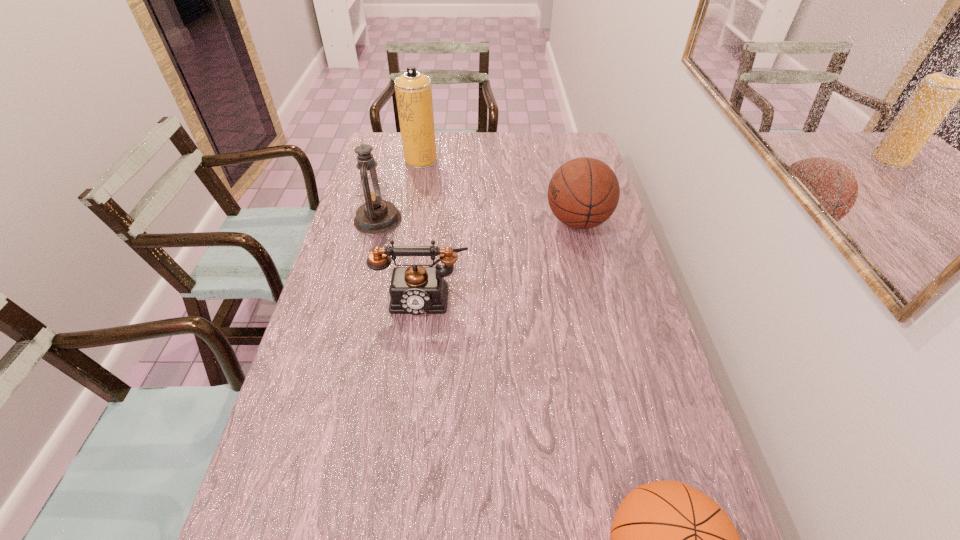
You are a GUI agent. You are given a task and a screenshot of the screen. Output one action in this format:
    pyautogui.click(x=<x>, y=<y>)
    Task: Click on the vacant space that's between the farther basketball and the fourth farthest object
    
    Given the screenshot: What is the action you would take?
    pyautogui.click(x=500, y=258)

Where is `free space between the fourth shortest object and the farther basketball`? Image resolution: width=960 pixels, height=540 pixels. free space between the fourth shortest object and the farther basketball is located at coordinates (478, 220).

At what (x,y) coordinates should I click in order to perform the action: click on empty space between the telephone and the oil lamp. Please return your answer as a coordinate pair (x, y). Looking at the image, I should click on (400, 258).

This screenshot has height=540, width=960. I want to click on free spot between the farther basketball and the aerosol can, so pyautogui.click(x=499, y=191).

At what (x,y) coordinates should I click in order to perform the action: click on vacant area between the fourth shortest object and the farther basketball. Please return your answer as a coordinate pair (x, y). The height and width of the screenshot is (540, 960). Looking at the image, I should click on (478, 220).

Select which object appears as the fourth closest to the farther basketball. Please provide its 2D coordinates. Your answer should be formatted as a tuple, i.e. [(x, y)], where the tuple contains the x and y coordinates of a point satisfying the conditions above.

[(668, 539)]

The width and height of the screenshot is (960, 540). In order to click on object that is the second closest to the second tallest object in this screenshot , I will do `click(413, 90)`.

Where is `vacant space that satisfies the following two spatial constraints: 1. on the side with brand label of the farther basketball; 2. on the front of the telephone at the rotary dial`? vacant space that satisfies the following two spatial constraints: 1. on the side with brand label of the farther basketball; 2. on the front of the telephone at the rotary dial is located at coordinates (596, 295).

This screenshot has width=960, height=540. In order to click on free space that satisfies the following two spatial constraints: 1. on the side with brand label of the farther basketball; 2. on the front of the telephone at the rotary dial in this screenshot , I will do (x=596, y=295).